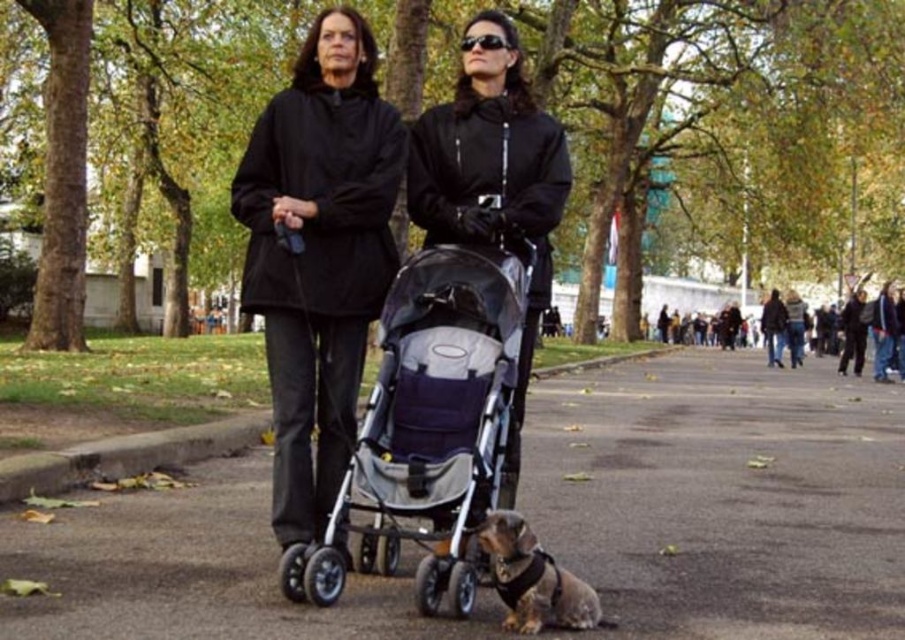
You are a photographer trying to capture a photo of the metallic stroller at center and the brown fur dog at lower center. If you want to ensure both subjects are in focus, which one should you focus on first, the taller object?

The metallic stroller at center is not as tall as the brown fur dog at lower center, so you should focus on the brown fur dog at lower center first since it is taller and requires proper focus alignment.